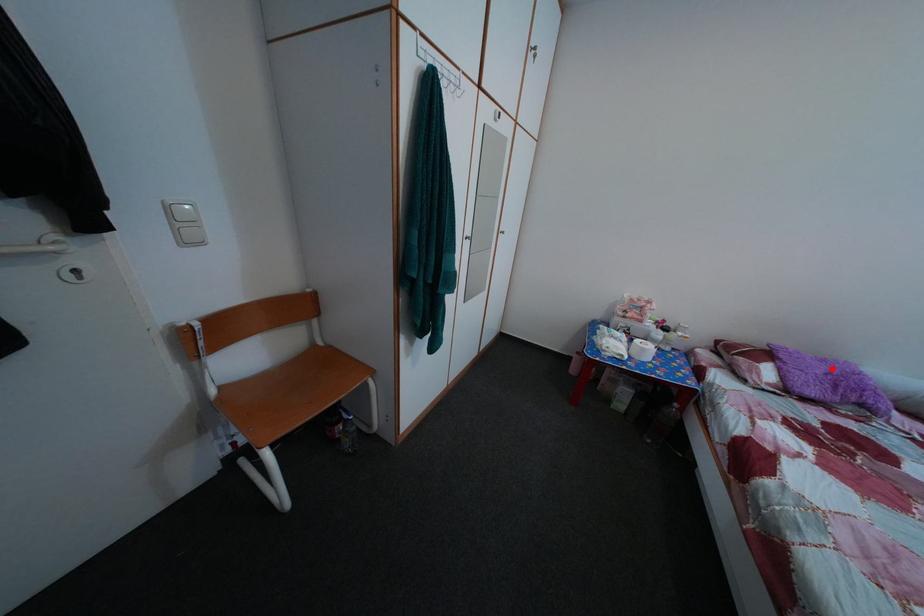
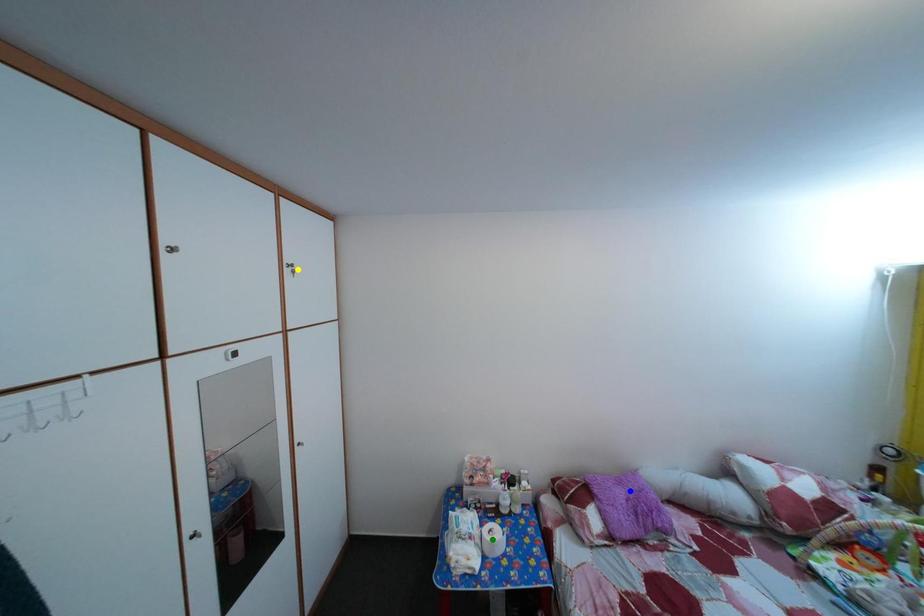
Question: I am providing you with two images of the same scene from different viewpoints. A red point is marked on the first image. You are given multiple points on the second image. Which point in image 2 is actually the same real-world point as the red point in image 1?

Choices:
 (A) yellow point
 (B) green point
 (C) blue point

Answer: (C)